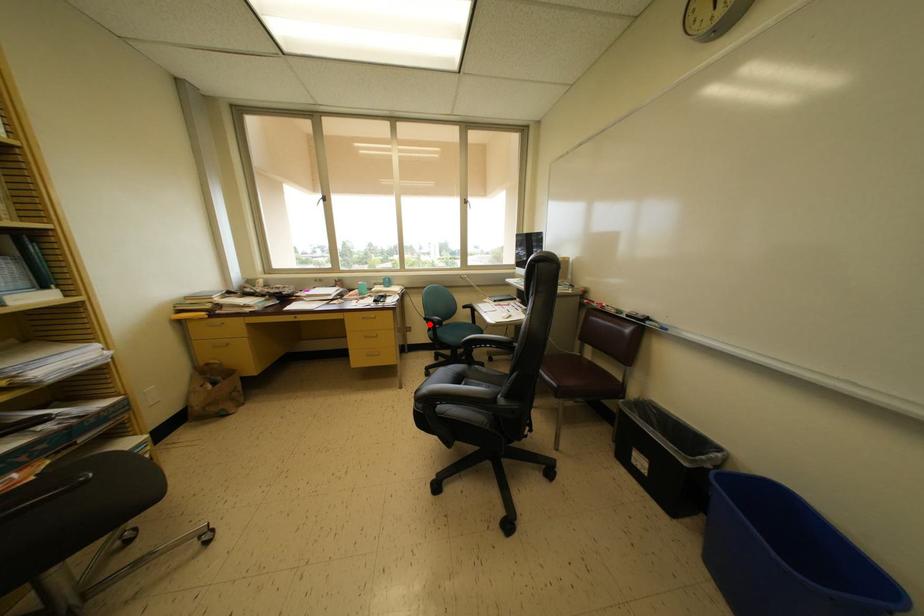
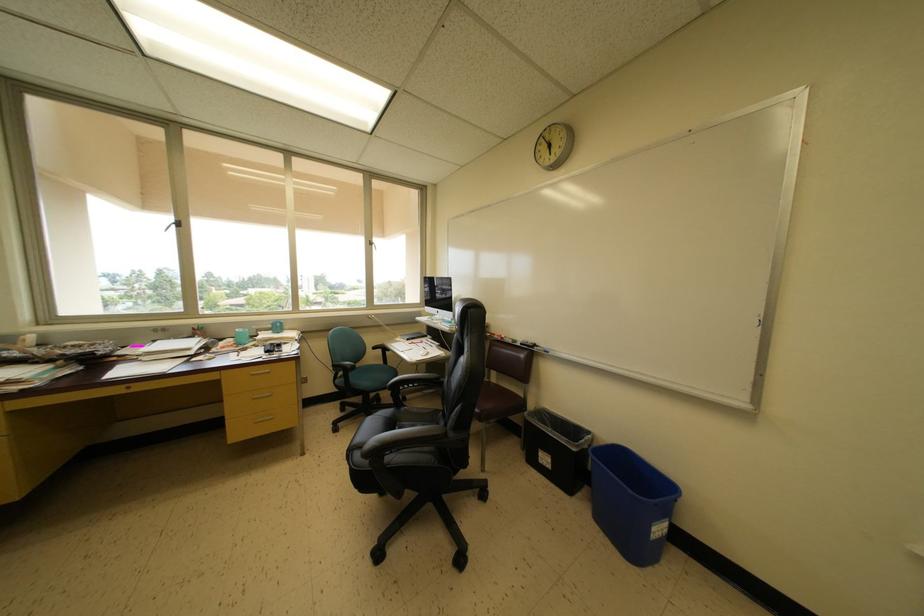
Find the pixel in the second image that matches the highlighted location in the first image.

(338, 371)